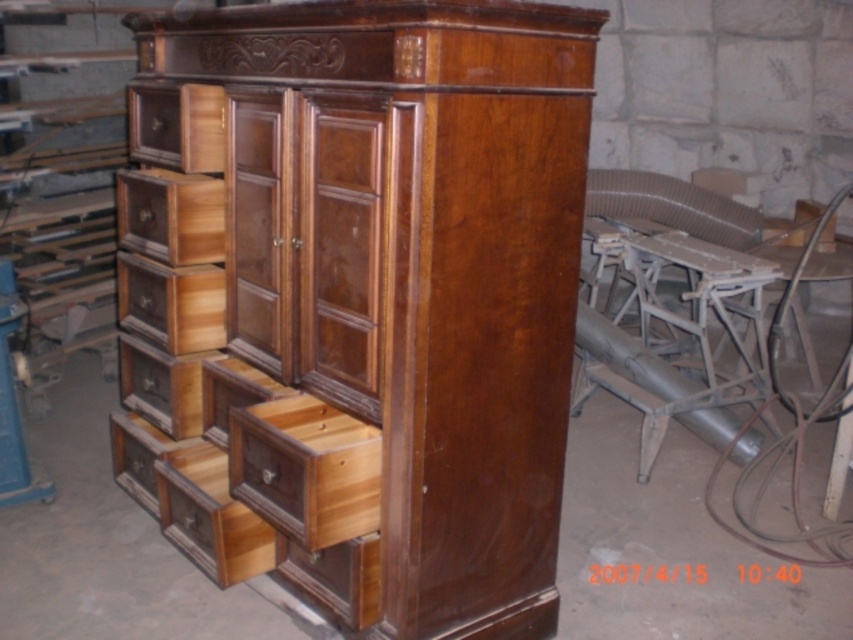
Question: Is light brown wood drawer at lower left wider than wooden drawer at upper left?

Choices:
 (A) no
 (B) yes

Answer: (A)

Question: Does shiny brown wood dresser at center have a greater width compared to wooden drawer at center?

Choices:
 (A) yes
 (B) no

Answer: (A)

Question: Considering the real-world distances, which object is closest to the wooden drawer at lower left?

Choices:
 (A) wooden drawer at center
 (B) wooden drawer at center-left

Answer: (B)

Question: Observing the image, what is the correct spatial positioning of shiny brown wood dresser at center in reference to wooden drawer at center-left?

Choices:
 (A) below
 (B) above

Answer: (A)

Question: Which of these objects is positioned closest to the wooden drawer at upper left?

Choices:
 (A) light brown wood drawer at lower left
 (B) wooden drawer at center-left
 (C) wooden drawer at lower left

Answer: (B)

Question: Which point is farther from the camera taking this photo?

Choices:
 (A) (264, 412)
 (B) (209, 458)
 (C) (218, 300)
 (D) (401, 472)

Answer: (B)